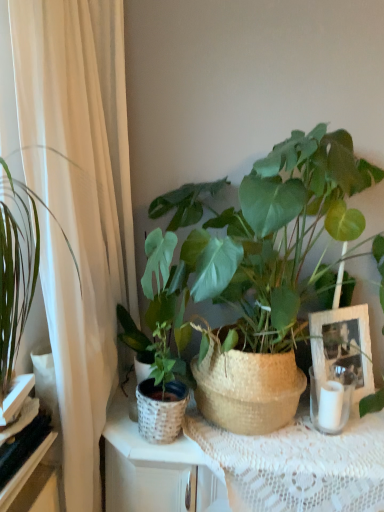
The image size is (384, 512). I want to click on vacant area in front of white glass candle holder at right, so click(337, 443).